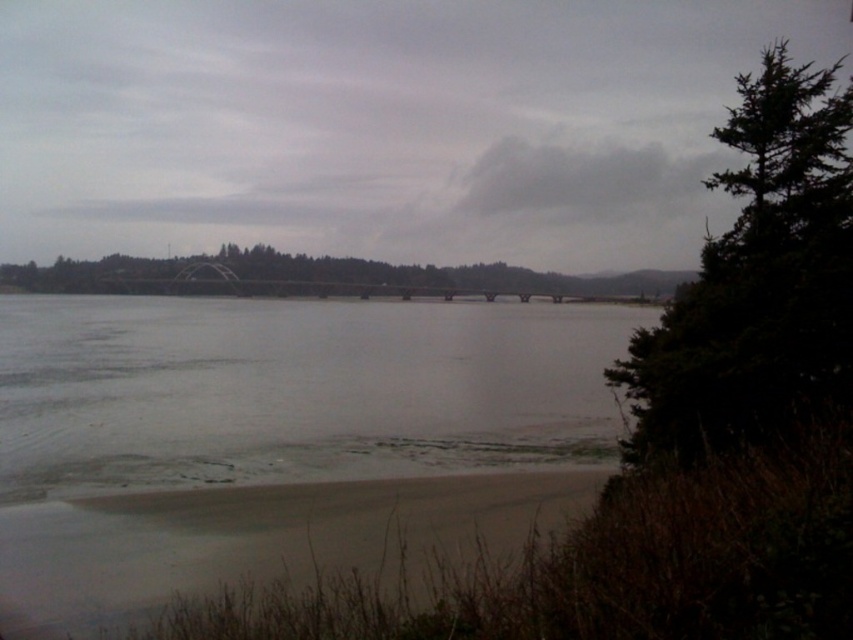
Question: Is clear water at center behind dark green textured tree at right?

Choices:
 (A) yes
 (B) no

Answer: (A)

Question: Among these points, which one is farthest from the camera?

Choices:
 (A) (444, 483)
 (B) (134, 268)
 (C) (724, 417)

Answer: (B)

Question: Which point is closer to the camera?

Choices:
 (A) clear water at center
 (B) sandy shore at lower left
 (C) green matte tree at center
 (D) dark green textured tree at right

Answer: (B)

Question: Is dark green textured tree at right smaller than sandy shore at lower left?

Choices:
 (A) no
 (B) yes

Answer: (A)

Question: Is clear water at center thinner than green matte tree at center?

Choices:
 (A) no
 (B) yes

Answer: (B)

Question: Estimate the real-world distances between objects in this image. Which object is closer to the green matte tree at center?

Choices:
 (A) clear water at center
 (B) dark green textured tree at right

Answer: (A)